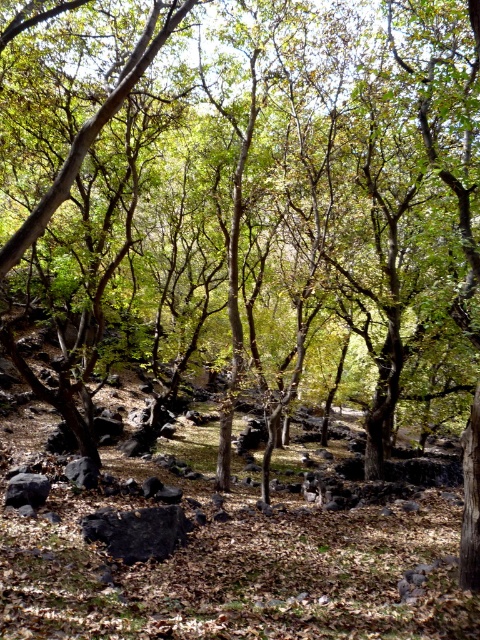
Question: Among these objects, which one is nearest to the camera?

Choices:
 (A) dark gray rock at lower left
 (B) black rock at center
 (C) black smooth rock at lower left

Answer: (B)

Question: From the image, what is the correct spatial relationship of dark gray rock at lower left in relation to black smooth rock at lower left?

Choices:
 (A) below
 (B) above

Answer: (B)

Question: Which point appears closest to the camera in this image?

Choices:
 (A) (132, 536)
 (B) (22, 493)
 (C) (90, 483)

Answer: (A)

Question: Which object appears closest to the camera in this image?

Choices:
 (A) black smooth rock at lower left
 (B) black rock at center

Answer: (B)

Question: Can you confirm if black rock at center is positioned below dark gray rock at lower left?

Choices:
 (A) yes
 (B) no

Answer: (A)

Question: Can you confirm if black rock at center is positioned above dark gray rock at lower left?

Choices:
 (A) yes
 (B) no

Answer: (B)